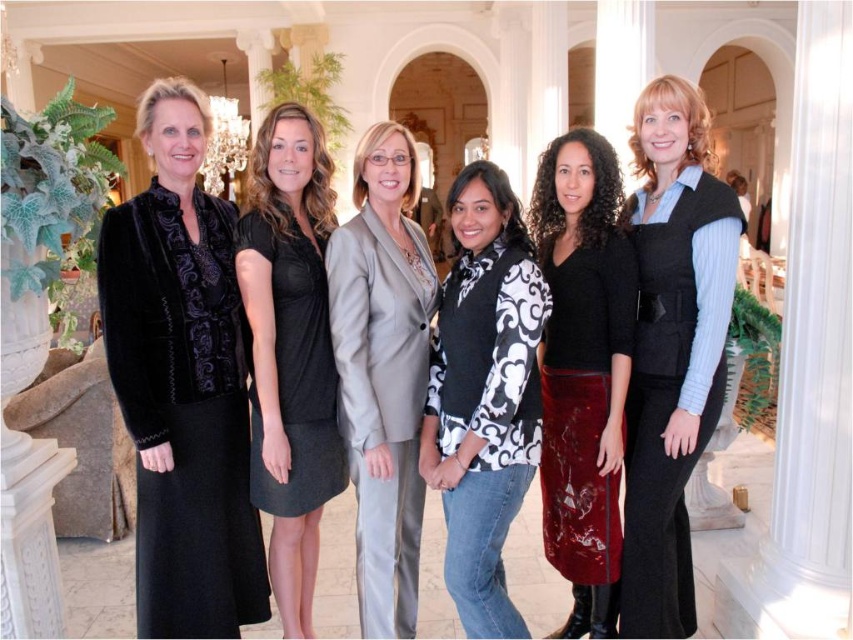
Who is positioned more to the right, velvet black dress at left or velvet skirt at center?

velvet skirt at center is more to the right.

Can you confirm if velvet black dress at left is bigger than velvet skirt at center?

Yes, velvet black dress at left is bigger than velvet skirt at center.

The image size is (853, 640). Find the location of `velvet black dress at left`. velvet black dress at left is located at coordinates (183, 381).

Is velvet black dress at left thinner than light gray satin blazer at center?

In fact, velvet black dress at left might be wider than light gray satin blazer at center.

What do you see at coordinates (183, 381) in the screenshot?
I see `velvet black dress at left` at bounding box center [183, 381].

What are the coordinates of `velvet black dress at left` in the screenshot? It's located at (183, 381).

Is point (468, 561) behind point (567, 356)?

No, it is in front of (567, 356).

Who is more distant from viewer, (422, 420) or (612, 579)?

Positioned behind is point (422, 420).

Is point (505, 310) less distant than point (560, 212)?

Yes.

Locate an element on the screen. The height and width of the screenshot is (640, 853). black and white patterned top at center is located at coordinates (485, 394).